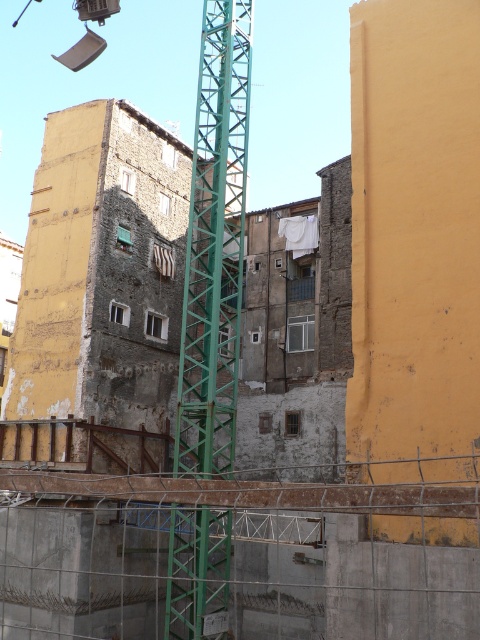
Does green metal tower crane at center appear on the left side of green metallic tower crane at center?

No, green metal tower crane at center is not to the left of green metallic tower crane at center.

Can you confirm if green metal tower crane at center is shorter than green metallic tower crane at center?

Indeed, green metal tower crane at center has a lesser height compared to green metallic tower crane at center.

Looking at this image, measure the distance between point (416, 516) and camera.

Point (416, 516) and camera are 66.75 feet apart.

Where is `green metal tower crane at center`? green metal tower crane at center is located at coordinates (228, 550).